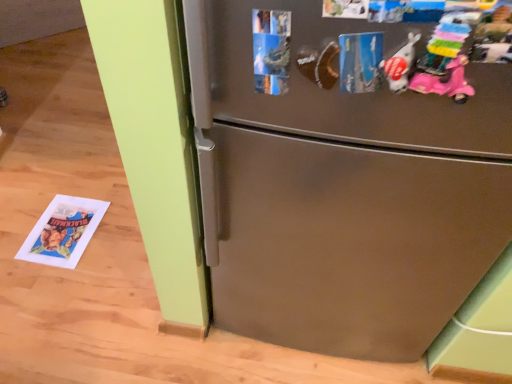
Question: Is pastel plastic toy at upper right, the 1th toy in the right-to-left sequence, facing towards white matte plush toy at upper right, which is the second toy in right-to-left order?

Choices:
 (A) yes
 (B) no

Answer: (B)

Question: Is pastel plastic toy at upper right, which is counted as the second toy, starting from the left, positioned in front of white matte plush toy at upper right, which is the second toy in right-to-left order?

Choices:
 (A) no
 (B) yes

Answer: (B)

Question: Does pastel plastic toy at upper right, the 1th toy in the right-to-left sequence, appear on the left side of white matte plush toy at upper right, which is the second toy in right-to-left order?

Choices:
 (A) no
 (B) yes

Answer: (A)

Question: Is white matte plush toy at upper right, which is the second toy in right-to-left order, surrounded by pastel plastic toy at upper right, the 1th toy in the right-to-left sequence?

Choices:
 (A) no
 (B) yes

Answer: (A)

Question: Does pastel plastic toy at upper right, the 1th toy in the right-to-left sequence, have a greater height compared to white matte plush toy at upper right, which ranks as the 1th toy in left-to-right order?

Choices:
 (A) no
 (B) yes

Answer: (A)

Question: Would you say stainless steel refrigerator at center is to the left or to the right of white matte plush toy at upper right, which is the second toy in right-to-left order, in the picture?

Choices:
 (A) left
 (B) right

Answer: (A)

Question: From a real-world perspective, is stainless steel refrigerator at center above or below white matte plush toy at upper right, which ranks as the 1th toy in left-to-right order?

Choices:
 (A) below
 (B) above

Answer: (A)

Question: Looking at the image, does stainless steel refrigerator at center seem bigger or smaller compared to white matte plush toy at upper right, which ranks as the 1th toy in left-to-right order?

Choices:
 (A) big
 (B) small

Answer: (A)

Question: In terms of width, does stainless steel refrigerator at center look wider or thinner when compared to white matte plush toy at upper right, which ranks as the 1th toy in left-to-right order?

Choices:
 (A) wide
 (B) thin

Answer: (A)

Question: Considering their positions, is stainless steel refrigerator at center located in front of or behind pastel plastic toy at upper right, the 1th toy in the right-to-left sequence?

Choices:
 (A) front
 (B) behind

Answer: (B)

Question: From a real-world perspective, is stainless steel refrigerator at center above or below pastel plastic toy at upper right, which is counted as the second toy, starting from the left?

Choices:
 (A) above
 (B) below

Answer: (B)

Question: Is point (307, 147) closer or farther from the camera than point (433, 69)?

Choices:
 (A) closer
 (B) farther

Answer: (B)

Question: From the image's perspective, is stainless steel refrigerator at center located above or below pastel plastic toy at upper right, which is counted as the second toy, starting from the left?

Choices:
 (A) above
 (B) below

Answer: (B)

Question: Do you think pastel plastic toy at upper right, the 1th toy in the right-to-left sequence, is within stainless steel refrigerator at center, or outside of it?

Choices:
 (A) outside
 (B) inside

Answer: (A)

Question: Would you say pastel plastic toy at upper right, which is counted as the second toy, starting from the left, is to the left or to the right of stainless steel refrigerator at center in the picture?

Choices:
 (A) left
 (B) right

Answer: (B)